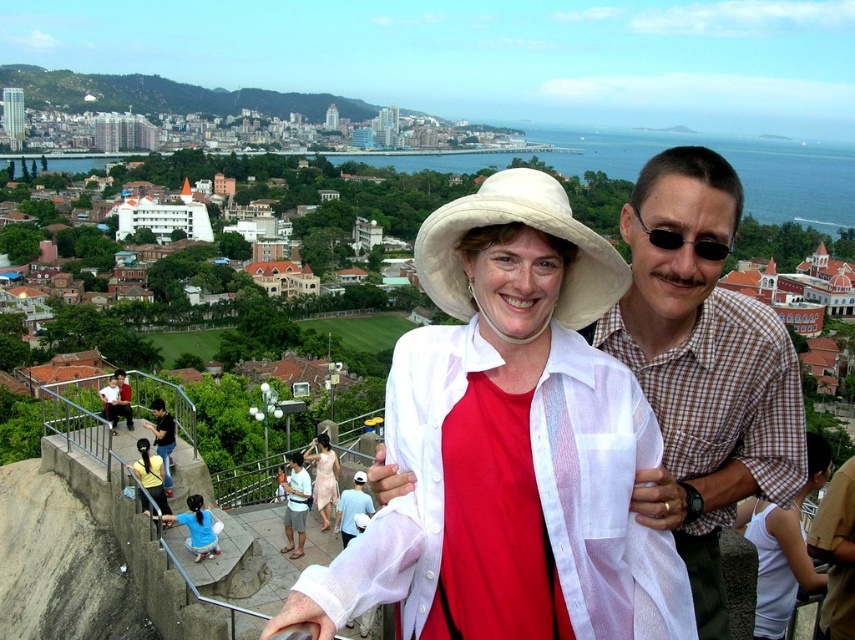
You are a photographer trying to capture a detailed shot of both the yellow fabric shirt at lower left and the black plastic sunglasses at upper right. Which object should you focus on first if you want to ensure both are in sharp focus, considering their positions?

The yellow fabric shirt at lower left is below the black plastic sunglasses at upper right, so focusing on the black plastic sunglasses at upper right first will help ensure both are in sharp focus as the shirt is closer to the camera.

In the scene shown: You are a photographer trying to capture a photo of the brown checkered shirt at center and the matte pink dress at center. Since you want to ensure both are fully visible in the frame, which one should you adjust the camera angle to focus on first?

The brown checkered shirt at center is much taller than the matte pink dress at center, so you should focus on the brown checkered shirt at center first to ensure it fits within the frame before adjusting for the shorter matte pink dress at center.